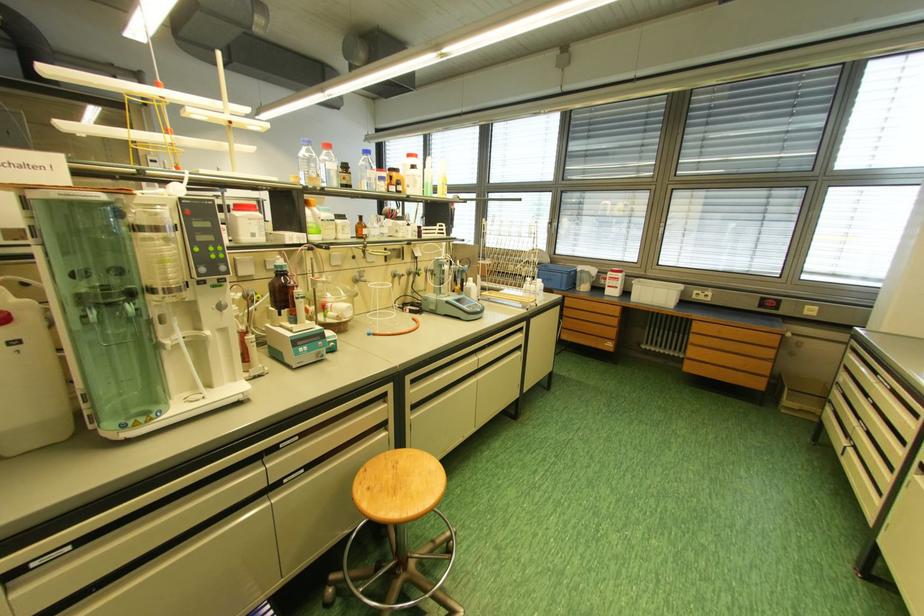
What do you see at coordinates (115, 337) in the screenshot?
I see `a green safety shield` at bounding box center [115, 337].